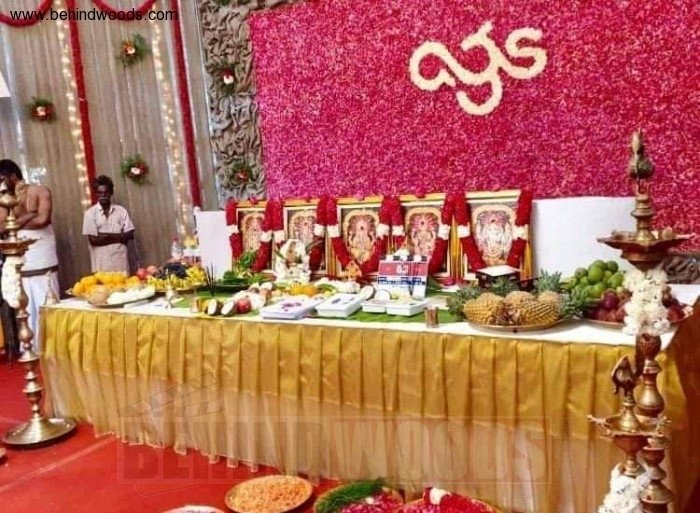
Locate an element on the screen. Image resolution: width=700 pixels, height=513 pixels. wreath is located at coordinates (133, 170), (134, 39), (41, 105).